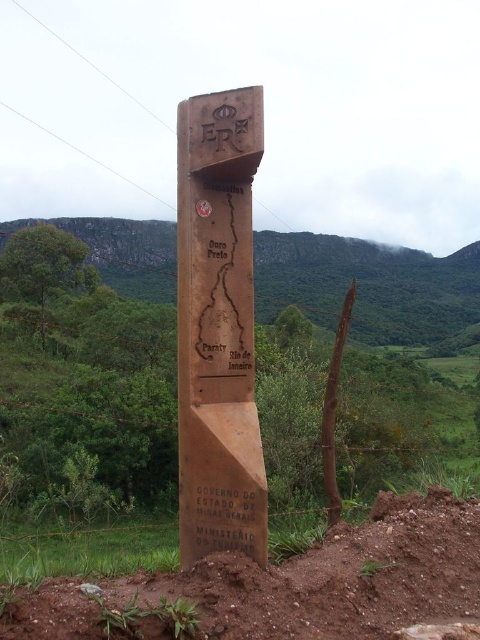
Question: Which of these objects is positioned farthest from the brown soil at lower center?

Choices:
 (A) wooden signpost at center
 (B) black matte text at lower center
 (C) brown wooden signpost at center

Answer: (C)

Question: Which object appears closest to the camera in this image?

Choices:
 (A) brown soil at lower center
 (B) brown wooden signpost at center
 (C) wooden signpost at center

Answer: (A)

Question: Is wooden signpost at center above black matte text at lower center?

Choices:
 (A) yes
 (B) no

Answer: (A)

Question: Can you confirm if brown soil at lower center is positioned to the left of black matte text at lower center?

Choices:
 (A) yes
 (B) no

Answer: (B)

Question: Which of the following is the closest to the observer?

Choices:
 (A) brown wooden signpost at center
 (B) brown soil at lower center

Answer: (B)

Question: Where is wooden signpost at center located in relation to black matte text at lower center in the image?

Choices:
 (A) below
 (B) above

Answer: (B)